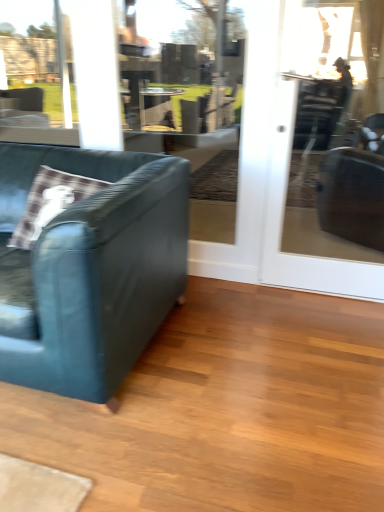
Locate an element on the screen. The width and height of the screenshot is (384, 512). free space that is to the left of transparent glass screen door at center is located at coordinates (238, 298).